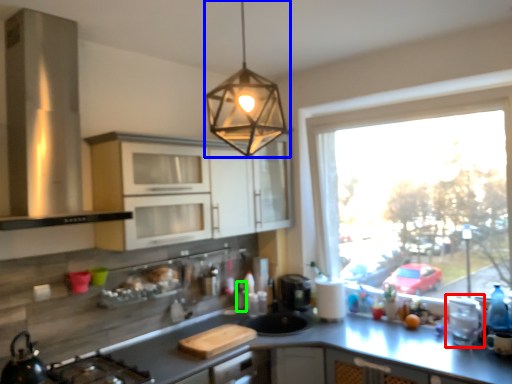
Question: Estimate the real-world distances between objects in this image. Which object is farther from appliance (highlighted by a red box), lamp (highlighted by a blue box) or bottle (highlighted by a green box)?

Choices:
 (A) lamp
 (B) bottle

Answer: (A)